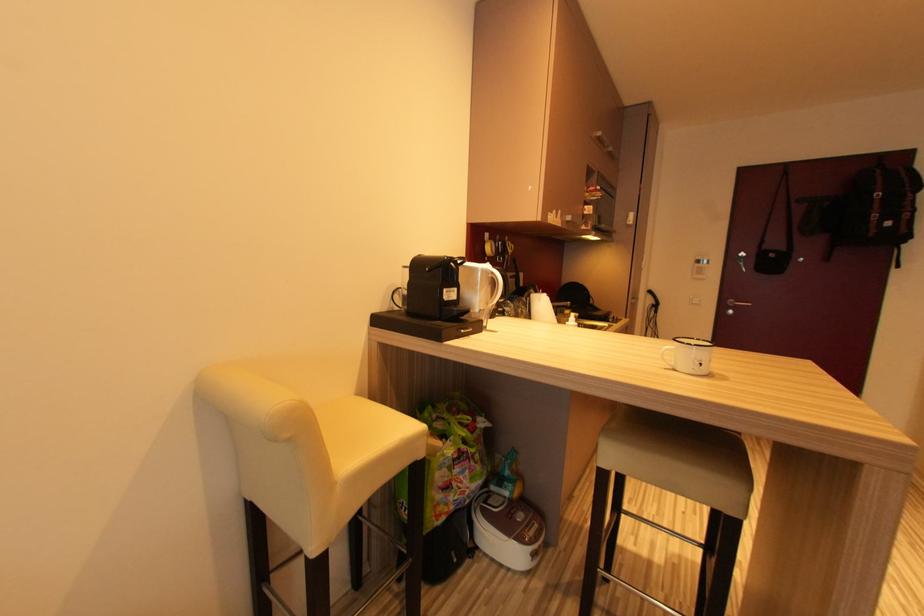
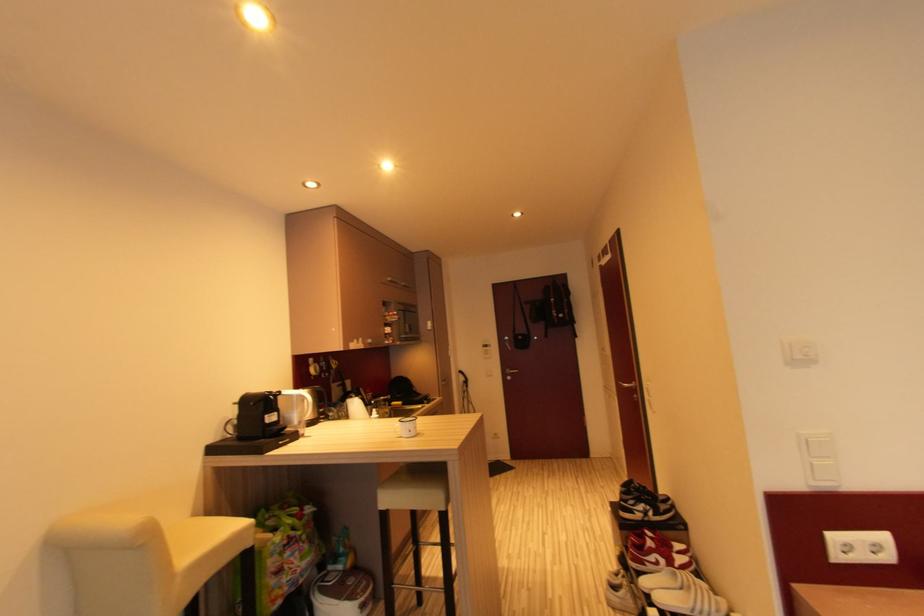
Question: The camera is either moving clockwise (left) or counter-clockwise (right) around the object. The first image is from the beginning of the video and the second image is from the end. Is the camera moving left or right when shooting the video?

Choices:
 (A) Left
 (B) Right

Answer: (A)